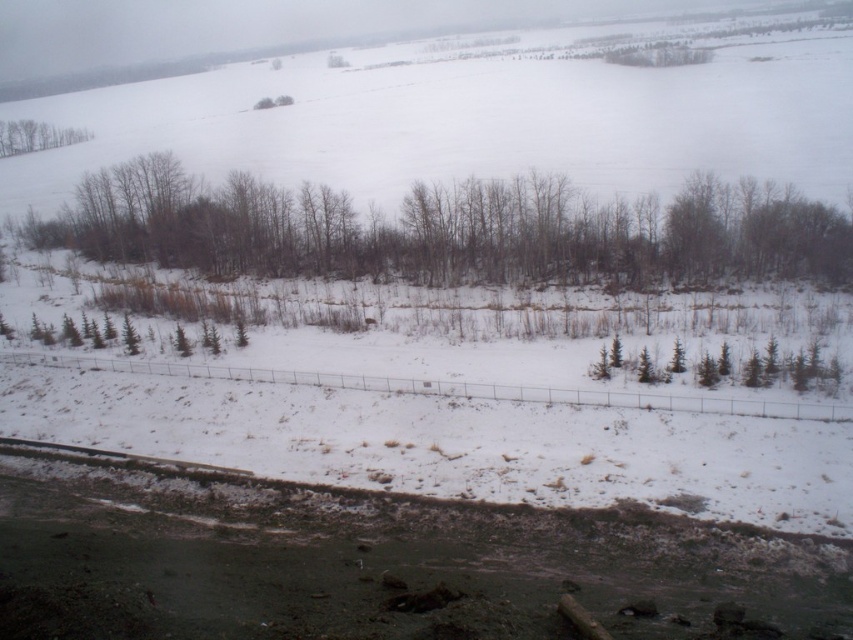
Which is above, metallic wire fence at center or green matte trees at upper left?

green matte trees at upper left is above.

Is metallic wire fence at center positioned before green matte trees at upper left?

Yes, it is in front of green matte trees at upper left.

Which is behind, point (695, 397) or point (9, 131)?

Positioned behind is point (9, 131).

Locate an element on the screen. The height and width of the screenshot is (640, 853). metallic wire fence at center is located at coordinates point(444,387).

Who is lower down, brown/dry wood trees at center or green matte trees at upper left?

Positioned lower is brown/dry wood trees at center.

The height and width of the screenshot is (640, 853). What are the coordinates of `brown/dry wood trees at center` in the screenshot? It's located at (450, 230).

The height and width of the screenshot is (640, 853). I want to click on brown/dry wood trees at center, so click(450, 230).

Does brown/dry wood trees at center have a greater height compared to metallic wire fence at center?

Yes.

Looking at this image, can you confirm if brown/dry wood trees at center is positioned above metallic wire fence at center?

Yes, brown/dry wood trees at center is above metallic wire fence at center.

Does point (107, 253) come closer to viewer compared to point (393, 381)?

That is False.

You are a GUI agent. You are given a task and a screenshot of the screen. Output one action in this format:
    pyautogui.click(x=<x>, y=<y>)
    Task: Click on the brown/dry wood trees at center
    
    Given the screenshot: What is the action you would take?
    click(x=450, y=230)